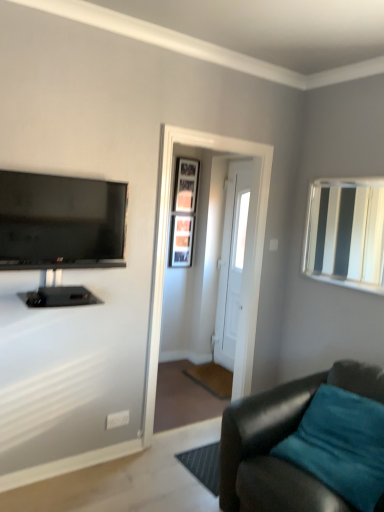
Question: Is white glossy mirror at upper right positioned before wooden framed picture at center, the 1th picture frame from the top?

Choices:
 (A) no
 (B) yes

Answer: (B)

Question: Does white glossy mirror at upper right have a greater height compared to wooden framed picture at center, which is the 2th picture frame in bottom-to-top order?

Choices:
 (A) yes
 (B) no

Answer: (A)

Question: Does white glossy mirror at upper right appear on the left side of wooden framed picture at center, the 1th picture frame from the top?

Choices:
 (A) yes
 (B) no

Answer: (B)

Question: From the image's perspective, is white glossy mirror at upper right on top of wooden framed picture at center, which is the 2th picture frame in bottom-to-top order?

Choices:
 (A) yes
 (B) no

Answer: (B)

Question: From a real-world perspective, is white glossy mirror at upper right positioned over wooden framed picture at center, which is the 2th picture frame in bottom-to-top order, based on gravity?

Choices:
 (A) yes
 (B) no

Answer: (B)

Question: Is wooden picture frame at center, positioned as the first picture frame in bottom-to-top order, bigger or smaller than white wooden door at center?

Choices:
 (A) small
 (B) big

Answer: (A)

Question: Choose the correct answer: Is wooden picture frame at center, which is the 2th picture frame from top to bottom, inside white wooden door at center or outside it?

Choices:
 (A) inside
 (B) outside

Answer: (B)

Question: Considering their positions, is wooden picture frame at center, positioned as the first picture frame in bottom-to-top order, located in front of or behind white wooden door at center?

Choices:
 (A) front
 (B) behind

Answer: (B)

Question: Is point click(x=173, y=223) positioned closer to the camera than point click(x=230, y=265)?

Choices:
 (A) farther
 (B) closer

Answer: (A)

Question: Relative to wooden framed picture at center, which is the 2th picture frame in bottom-to-top order, is white glossy mirror at upper right in front or behind?

Choices:
 (A) front
 (B) behind

Answer: (A)

Question: In the image, is white glossy mirror at upper right on the left side or the right side of wooden framed picture at center, which is the 2th picture frame in bottom-to-top order?

Choices:
 (A) left
 (B) right

Answer: (B)

Question: Looking at the image, does white glossy mirror at upper right seem bigger or smaller compared to wooden framed picture at center, which is the 2th picture frame in bottom-to-top order?

Choices:
 (A) big
 (B) small

Answer: (A)

Question: Would you say white glossy mirror at upper right is inside or outside wooden framed picture at center, which is the 2th picture frame in bottom-to-top order?

Choices:
 (A) outside
 (B) inside

Answer: (A)

Question: Based on their sizes in the image, would you say teal leather couch at lower right is bigger or smaller than wooden picture frame at center, positioned as the first picture frame in bottom-to-top order?

Choices:
 (A) small
 (B) big

Answer: (B)

Question: Considering the positions of point (276, 438) and point (173, 238), is point (276, 438) closer or farther from the camera than point (173, 238)?

Choices:
 (A) farther
 (B) closer

Answer: (B)